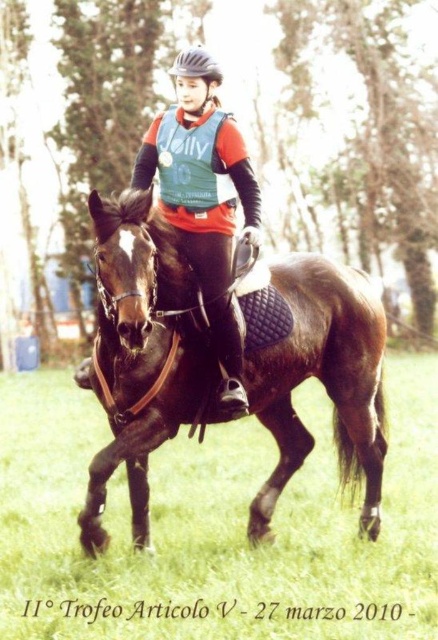
Is brown glossy horse at center smaller than black matte helmet at upper center?

No, brown glossy horse at center is not smaller than black matte helmet at upper center.

Does brown glossy horse at center have a greater width compared to black matte helmet at upper center?

Correct, the width of brown glossy horse at center exceeds that of black matte helmet at upper center.

Is point (117, 304) farther from viewer compared to point (194, 113)?

That is False.

What are the coordinates of `brown glossy horse at center` in the screenshot? It's located at (141, 353).

Does green grass at center have a larger size compared to brown glossy horse at center?

Incorrect, green grass at center is not larger than brown glossy horse at center.

This screenshot has height=640, width=438. What do you see at coordinates (215, 525) in the screenshot?
I see `green grass at center` at bounding box center [215, 525].

Is point (42, 392) positioned in front of point (130, 445)?

No, it is not.

Locate an element on the screen. The height and width of the screenshot is (640, 438). green grass at center is located at coordinates (215, 525).

Between green grass at center and black matte helmet at upper center, which one has less height?

With less height is green grass at center.

Between green grass at center and black matte helmet at upper center, which one has more height?

With more height is black matte helmet at upper center.

Is point (195, 532) more distant than point (201, 58)?

Yes.

Identify the location of green grass at center. The height and width of the screenshot is (640, 438). (215, 525).